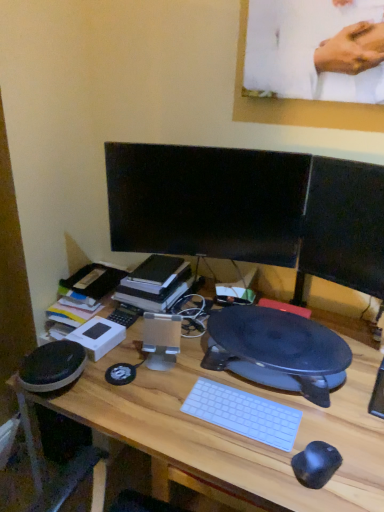
Describe the element at coordinates (206, 201) in the screenshot. I see `black glossy monitor at center, which is the 2th computer monitor in right-to-left order` at that location.

In order to face matte black monitor at center, the first computer monitor in the right-to-left sequence, should I rotate leftwards or rightwards?

Rotate your view right by about 20.249°.

I want to click on hardcover book at center, so click(x=155, y=283).

Identify the location of black glossy monitor at center, arranged as the first computer monitor when viewed from the left. (206, 201).

Looking at this image, could wooden desk at center be considered to be inside matte black monitor at center, which is the 2th computer monitor in left-to-right order?

No, matte black monitor at center, which is the 2th computer monitor in left-to-right order, does not contain wooden desk at center.

Between matte black monitor at center, which is the 2th computer monitor in left-to-right order, and wooden desk at center, which one is positioned behind?

matte black monitor at center, which is the 2th computer monitor in left-to-right order.

From their relative heights in the image, would you say matte black monitor at center, the first computer monitor in the right-to-left sequence, is taller or shorter than wooden desk at center?

Considering their sizes, matte black monitor at center, the first computer monitor in the right-to-left sequence, has less height than wooden desk at center.

Does matte black monitor at center, the first computer monitor in the right-to-left sequence, appear on the right side of wooden desk at center?

Yes, matte black monitor at center, the first computer monitor in the right-to-left sequence, is to the right of wooden desk at center.

Considering the relative sizes of wooden desk at center and matte black monitor at center, the first computer monitor in the right-to-left sequence, in the image provided, is wooden desk at center thinner than matte black monitor at center, the first computer monitor in the right-to-left sequence,?

No, wooden desk at center is not thinner than matte black monitor at center, the first computer monitor in the right-to-left sequence.

How different are the orientations of wooden desk at center and matte black monitor at center, which is the 2th computer monitor in left-to-right order, in degrees?

They differ by 157 degrees in their facing directions.

Would you say matte black monitor at center, the first computer monitor in the right-to-left sequence, is part of wooden desk at center's contents?

That's incorrect, matte black monitor at center, the first computer monitor in the right-to-left sequence, is not inside wooden desk at center.

From a real-world perspective, between wooden desk at center and matte black monitor at center, the first computer monitor in the right-to-left sequence, who is vertically higher?

From a 3D spatial view, matte black monitor at center, the first computer monitor in the right-to-left sequence, is above.

Looking at this image, from a real-world perspective, between black glossy monitor at center, which is the 2th computer monitor in right-to-left order, and hardcover book at center, who is vertically higher?

In real-world perspective, black glossy monitor at center, which is the 2th computer monitor in right-to-left order, is above.

From the image's perspective, is black glossy monitor at center, which is the 2th computer monitor in right-to-left order, above or below hardcover book at center?

black glossy monitor at center, which is the 2th computer monitor in right-to-left order, is situated higher than hardcover book at center in the image.

What's the angular difference between black glossy monitor at center, arranged as the first computer monitor when viewed from the left, and hardcover book at center's facing directions?

There is a 17.8-degree angle between the facing directions of black glossy monitor at center, arranged as the first computer monitor when viewed from the left, and hardcover book at center.

Is matte black monitor at center, which is the 2th computer monitor in left-to-right order, not close to black glossy monitor at center, arranged as the first computer monitor when viewed from the left?

matte black monitor at center, which is the 2th computer monitor in left-to-right order, is actually quite close to black glossy monitor at center, arranged as the first computer monitor when viewed from the left.

Is point (350, 164) positioned in front of point (244, 152)?

That is True.

From a real-world perspective, which is physically below, matte black monitor at center, which is the 2th computer monitor in left-to-right order, or black glossy monitor at center, arranged as the first computer monitor when viewed from the left?

From a 3D spatial view, black glossy monitor at center, arranged as the first computer monitor when viewed from the left, is below.

Consider the image. Can you confirm if matte black monitor at center, which is the 2th computer monitor in left-to-right order, is bigger than black glossy monitor at center, which is the 2th computer monitor in right-to-left order?

Actually, matte black monitor at center, which is the 2th computer monitor in left-to-right order, might be smaller than black glossy monitor at center, which is the 2th computer monitor in right-to-left order.

Is hardcover book at center beside wooden desk at center?

No, hardcover book at center is not in contact with wooden desk at center.

Could you tell me if hardcover book at center is turned towards wooden desk at center?

No, hardcover book at center is not oriented towards wooden desk at center.

From a real-world perspective, which object rests below the other?

From a 3D spatial view, hardcover book at center is below.

I want to click on desk in front of the hardcover book at center, so click(233, 432).

Is wooden desk at center closer to camera compared to hardcover book at center?

Yes, the depth of wooden desk at center is less than that of hardcover book at center.

Looking at this image, from the image's perspective, is wooden desk at center located beneath hardcover book at center?

Correct, wooden desk at center appears lower than hardcover book at center in the image.

Where is `book behind the wooden desk at center`? Image resolution: width=384 pixels, height=512 pixels. book behind the wooden desk at center is located at coordinates (155, 283).

Is wooden desk at center turned away from hardcover book at center?

wooden desk at center does not have its back to hardcover book at center.

Which object is positioned more to the right, hardcover book at center or black glossy monitor at center, which is the 2th computer monitor in right-to-left order?

From the viewer's perspective, black glossy monitor at center, which is the 2th computer monitor in right-to-left order, appears more on the right side.

Is point (146, 296) farther from viewer compared to point (242, 244)?

Yes, it is behind point (242, 244).

Could you tell me if hardcover book at center is turned towards black glossy monitor at center, arranged as the first computer monitor when viewed from the left?

No.

In the image, is hardcover book at center positioned in front of or behind black glossy monitor at center, which is the 2th computer monitor in right-to-left order?

hardcover book at center is positioned farther from the viewer than black glossy monitor at center, which is the 2th computer monitor in right-to-left order.

You are a GUI agent. You are given a task and a screenshot of the screen. Output one action in this format:
    pyautogui.click(x=<x>, y=<y>)
    Task: Click on the desk below the matte black monitor at center, which is the 2th computer monitor in left-to-right order (from a real-world perspective)
    
    Given the screenshot: What is the action you would take?
    pyautogui.click(x=233, y=432)

Identify the location of the 1st computer monitor behind when counting from the wooden desk at center. The width and height of the screenshot is (384, 512). (343, 227).

Based on their spatial positions, is wooden desk at center or black glossy monitor at center, arranged as the first computer monitor when viewed from the left, further from matte black monitor at center, which is the 2th computer monitor in left-to-right order?

The object further to matte black monitor at center, which is the 2th computer monitor in left-to-right order, is wooden desk at center.

Consider the image. Looking at the image, which one is located closer to hardcover book at center, matte black monitor at center, which is the 2th computer monitor in left-to-right order, or black glossy monitor at center, which is the 2th computer monitor in right-to-left order?

black glossy monitor at center, which is the 2th computer monitor in right-to-left order, is positioned closer to the anchor hardcover book at center.

From the image, which object appears to be farther from hardcover book at center, wooden desk at center or black glossy monitor at center, which is the 2th computer monitor in right-to-left order?

wooden desk at center lies further to hardcover book at center than the other object.

Looking at the image, which one is located closer to black glossy monitor at center, which is the 2th computer monitor in right-to-left order, wooden desk at center or hardcover book at center?

Based on the image, hardcover book at center appears to be nearer to black glossy monitor at center, which is the 2th computer monitor in right-to-left order.

Considering their positions, is hardcover book at center positioned closer to wooden desk at center than black glossy monitor at center, arranged as the first computer monitor when viewed from the left?

hardcover book at center is closer to wooden desk at center.

Which object lies further to the anchor point black glossy monitor at center, which is the 2th computer monitor in right-to-left order, hardcover book at center or wooden desk at center?

Based on the image, wooden desk at center appears to be further to black glossy monitor at center, which is the 2th computer monitor in right-to-left order.

Consider the image. Looking at the image, which one is located closer to wooden desk at center, black glossy monitor at center, which is the 2th computer monitor in right-to-left order, or matte black monitor at center, the first computer monitor in the right-to-left sequence?

matte black monitor at center, the first computer monitor in the right-to-left sequence, is closer to wooden desk at center.

Looking at the image, which one is located closer to matte black monitor at center, which is the 2th computer monitor in left-to-right order, black glossy monitor at center, arranged as the first computer monitor when viewed from the left, or hardcover book at center?

black glossy monitor at center, arranged as the first computer monitor when viewed from the left.

Where is `computer monitor located between wooden desk at center and black glossy monitor at center, which is the 2th computer monitor in right-to-left order, in the depth direction`? computer monitor located between wooden desk at center and black glossy monitor at center, which is the 2th computer monitor in right-to-left order, in the depth direction is located at coordinates (343, 227).

At what (x,y) coordinates should I click in order to perform the action: click on computer monitor between hardcover book at center and matte black monitor at center, the first computer monitor in the right-to-left sequence. Please return your answer as a coordinate pair (x, y). This screenshot has height=512, width=384. Looking at the image, I should click on (206, 201).